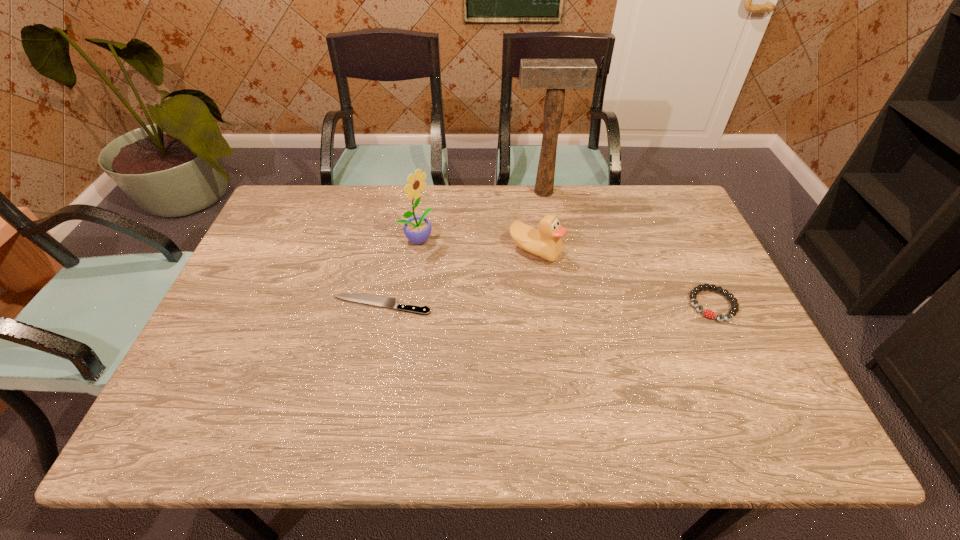
In order to click on free spot on the desktop that is between the shortest object and the second shortest object and is positioned on the striking surface of the tallest object in this screenshot , I will do `click(563, 305)`.

This screenshot has height=540, width=960. Identify the location of vacant spot on the desktop that is between the steak knife and the rightmost object and is positioned at the beak of the third tallest object. (558, 305).

I want to click on free space on the desktop that is between the shortest object and the rightmost object and is positioned on the front-facing side of the fourth shortest object, so click(x=543, y=305).